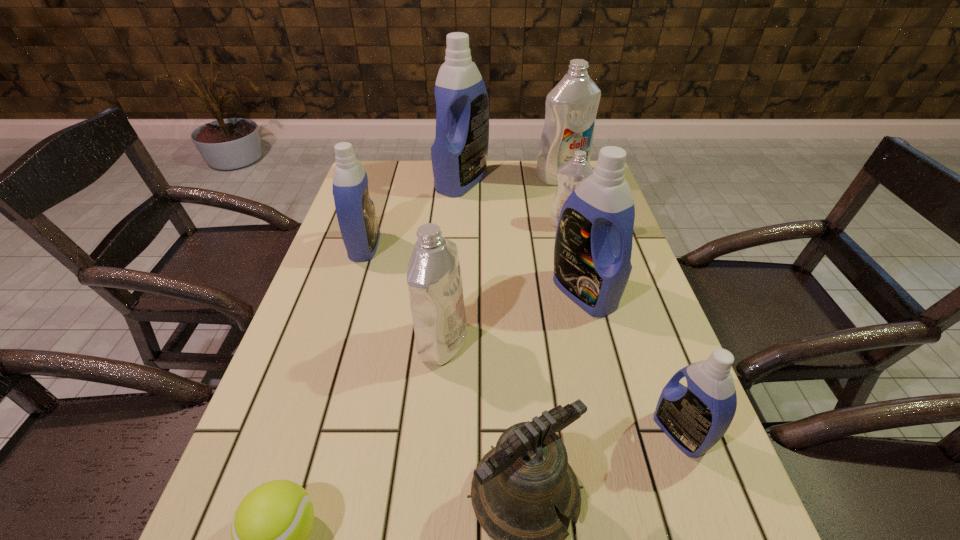
In order to click on vacant region at the far edge in this screenshot , I will do `click(411, 167)`.

Find the location of `blank space at the left edge`. blank space at the left edge is located at coordinates (298, 319).

Identify the location of free space at the right edge. (635, 342).

Where is `unoccupied position between the farthest blue detergent and the third biggest blue detergent`? unoccupied position between the farthest blue detergent and the third biggest blue detergent is located at coordinates (414, 214).

Find the location of a particular element. vacant region between the tallest detergent and the smallest white detergent is located at coordinates (516, 202).

Where is `empty space that is in between the third smallest blue detergent and the third biggest blue detergent`? empty space that is in between the third smallest blue detergent and the third biggest blue detergent is located at coordinates (474, 269).

Locate an element on the screen. Image resolution: width=960 pixels, height=540 pixels. vacant space in between the smallest blue detergent and the biggest white detergent is located at coordinates (621, 305).

Identify the location of vacant area that lies between the farthest white detergent and the leftmost white detergent. (502, 259).

Image resolution: width=960 pixels, height=540 pixels. What are the coordinates of `free space between the nearest white detergent and the smallest white detergent` in the screenshot? It's located at (506, 283).

I want to click on vacant area that lies between the second biggest blue detergent and the leftmost white detergent, so click(514, 317).